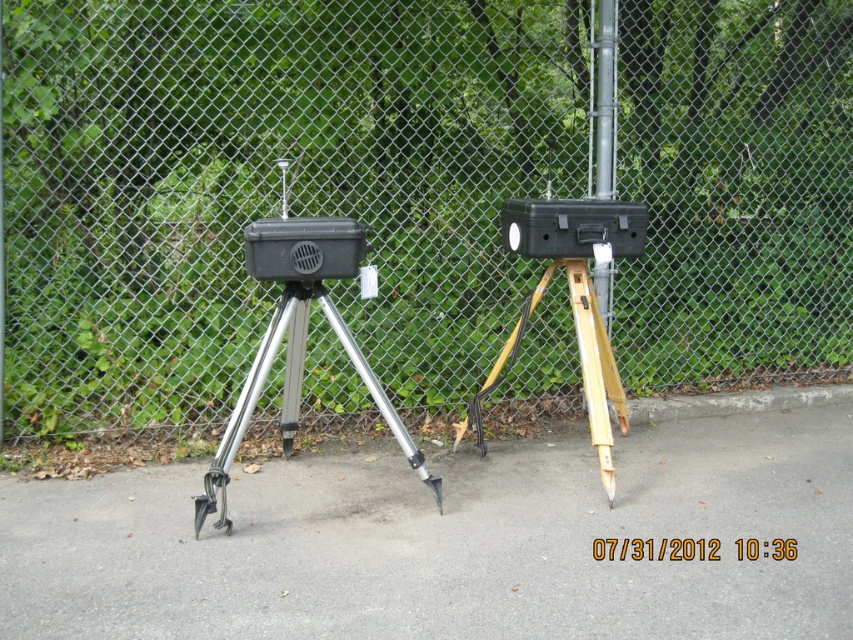
Question: Among these points, which one is farthest from the camera?

Choices:
 (A) (225, 184)
 (B) (49, 522)

Answer: (A)

Question: Which point appears closest to the camera in this image?

Choices:
 (A) (764, 499)
 (B) (303, 301)
 (C) (608, 90)
 (D) (71, 131)

Answer: (B)

Question: In this image, where is metal mesh fence at center located relative to silver metallic tripod at center?

Choices:
 (A) above
 (B) below

Answer: (A)

Question: Is metal mesh fence at center thinner than silver metallic tripod at center?

Choices:
 (A) no
 (B) yes

Answer: (A)

Question: Which point is closer to the camera taking this photo?

Choices:
 (A) (164, 132)
 (B) (602, 77)
 (C) (325, 314)

Answer: (C)

Question: Observing the image, what is the correct spatial positioning of gray asphalt pavement at center in reference to wooden tripod at center?

Choices:
 (A) left
 (B) right

Answer: (A)